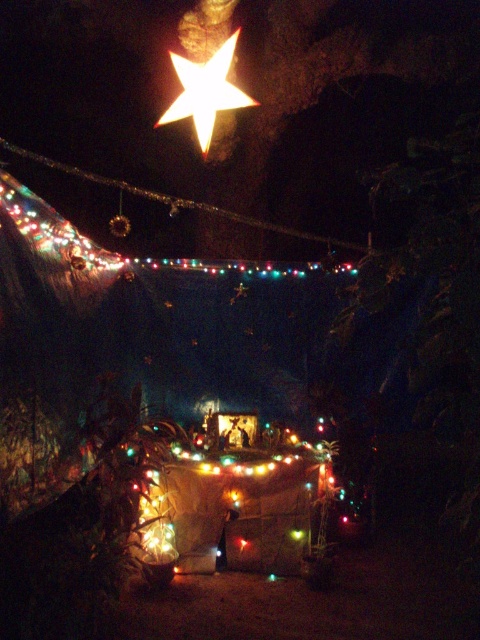
You are setting up a holiday display and want to ensure the bright white paper star at upper center is visible. Are the multicolored lights at upper center placed below it?

The bright white paper star at upper center is positioned over the multicolored lights at upper center, so yes, the multicolored lights at upper center are placed below it.

You are setting up a holiday display and want to place a 24 inch wide decoration between the bright white paper star at upper center and the multicolored lights at upper center. Can the decoration fit between them?

The bright white paper star at upper center and multicolored lights at upper center are 27.11 inches apart, so the 24 inch wide decoration can fit between them since the space is larger than the decoration.